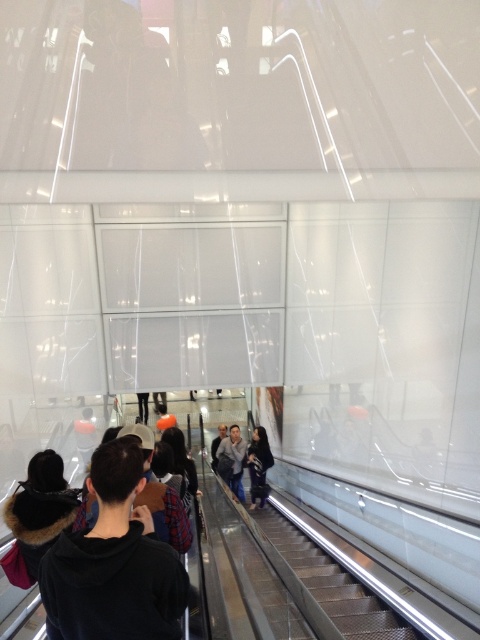
You are standing at the bottom of the escalator and see two people wearing a black hoodie at center and a dark gray jacket at center. Which clothing item is closer to you?

The black hoodie at center is closer to you than the dark gray jacket at center.

You are standing at the bottom of the escalator and want to ask someone at the top for directions. You see two people wearing a light gray sweater at center and a dark gray jacket at center. Which person would you need to look up higher to address?

You would need to look up higher to address the light gray sweater at center because it is much taller than the dark gray jacket at center.

Based on the photo, you are standing on the lower level of the building and want to reach the upper level. You see the metallic silver escalator at center and the dark gray jacket at center. Which object is located higher up?

The metallic silver escalator at center is positioned over the dark gray jacket at center, so the metallic silver escalator at center is higher up.